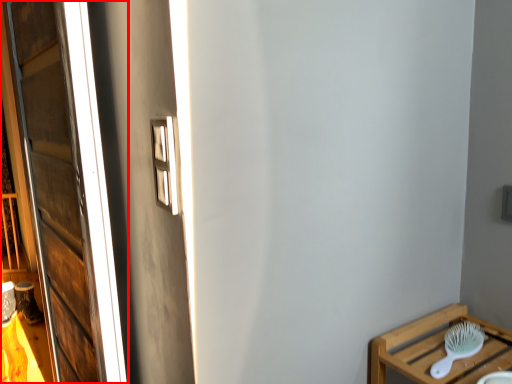
Question: From the image's perspective, where is window (annotated by the red box) located in relation to brush in the image?

Choices:
 (A) below
 (B) above

Answer: (B)